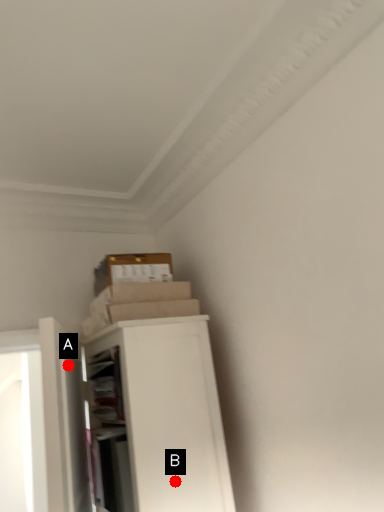
Question: Two points are circled on the image, labeled by A and B beside each circle. Among these points, which one is farthest from the camera?

Choices:
 (A) A is further
 (B) B is further

Answer: (A)